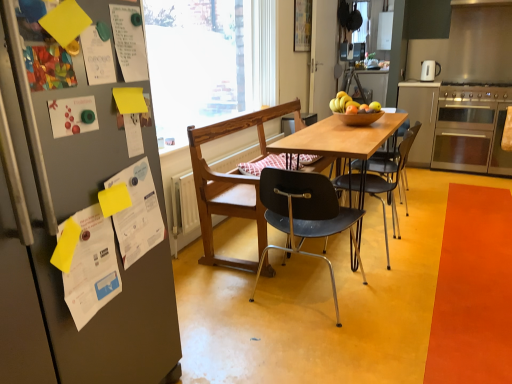
Where is `wooden bowl at center`? Image resolution: width=512 pixels, height=384 pixels. wooden bowl at center is located at coordinates (359, 118).

The width and height of the screenshot is (512, 384). What do you see at coordinates (302, 25) in the screenshot? I see `wooden framed poster at upper center, which is the seventh poster from bottom to top` at bounding box center [302, 25].

This screenshot has width=512, height=384. Describe the element at coordinates (340, 138) in the screenshot. I see `wooden table at center` at that location.

You are a GUI agent. You are given a task and a screenshot of the screen. Output one action in this format:
    pyautogui.click(x=<x>, y=<y>)
    Task: Click on the white glossy electric kettle at upper right
    The image size is (512, 384).
    Given the screenshot: What is the action you would take?
    pyautogui.click(x=429, y=70)

The height and width of the screenshot is (384, 512). I want to click on wooden bowl at center, so tap(359, 118).

Considering the positions of point (449, 353) and point (368, 182), is point (449, 353) closer or farther from the camera than point (368, 182)?

Point (449, 353).

Who is taller, orange matte mat at lower right or black plastic chair at center, positioned as the third chair in front-to-back order?

black plastic chair at center, positioned as the third chair in front-to-back order, is taller.

Looking at this image, considering the sizes of orange matte mat at lower right and black plastic chair at center, positioned as the third chair in front-to-back order, in the image, is orange matte mat at lower right wider or thinner than black plastic chair at center, positioned as the third chair in front-to-back order,?

Clearly, orange matte mat at lower right has more width compared to black plastic chair at center, positioned as the third chair in front-to-back order.

The width and height of the screenshot is (512, 384). Find the location of `mat lying below the black plastic chair at center, which appears as the 1th chair when viewed from the back (from the image's perspective)`. mat lying below the black plastic chair at center, which appears as the 1th chair when viewed from the back (from the image's perspective) is located at coordinates (473, 290).

Does yellow paper at left, which appears as the second poster when viewed from the back, appear on the left side of wooden framed poster at upper center, the first poster from the right?

Correct, you'll find yellow paper at left, which appears as the second poster when viewed from the back, to the left of wooden framed poster at upper center, the first poster from the right.

How many degrees apart are the facing directions of yellow paper at left, the 6th poster from the left, and wooden framed poster at upper center, the seventh poster in the front-to-back sequence?

There is a 3.97-degree angle between the facing directions of yellow paper at left, the 6th poster from the left, and wooden framed poster at upper center, the seventh poster in the front-to-back sequence.

From a real-world perspective, who is located higher, yellow paper at left, the second poster when ordered from bottom to top, or wooden framed poster at upper center, the first poster from the back?

In real-world perspective, wooden framed poster at upper center, the first poster from the back, is above.

In the scene shown: Is yellow paper at left, the second poster when ordered from bottom to top, positioned beyond the bounds of wooden framed poster at upper center, the first poster from the back?

yellow paper at left, the second poster when ordered from bottom to top, lies outside wooden framed poster at upper center, the first poster from the back,'s area.

At what (x,y) coordinates should I click in order to perform the action: click on poster located behind the stainless steel oven at right. Please return your answer as a coordinate pair (x, y). Looking at the image, I should click on (302, 25).

Could you tell me if stainless steel oven at right is turned towards wooden framed poster at upper center, the seventh poster in the front-to-back sequence?

No, stainless steel oven at right is not facing towards wooden framed poster at upper center, the seventh poster in the front-to-back sequence.

Is stainless steel oven at right far from wooden framed poster at upper center, which is the 1th poster from top to bottom?

Yes, stainless steel oven at right and wooden framed poster at upper center, which is the 1th poster from top to bottom, are located far from each other.

Could you tell me if wooden bowl at center is turned towards black plastic chair at center, which appears as the 3th chair when viewed from the back?

No.

Between wooden bowl at center and black plastic chair at center, which appears as the 3th chair when viewed from the back, which one has less height?

wooden bowl at center is shorter.

From the picture: From the image's perspective, is wooden bowl at center positioned above or below black plastic chair at center, the first chair when ordered from front to back?

From the image's perspective, wooden bowl at center appears above black plastic chair at center, the first chair when ordered from front to back.

Who is taller, black plastic chair at center, positioned as the third chair in front-to-back order, or black plastic chair at center, the first chair when ordered from front to back?

black plastic chair at center, positioned as the third chair in front-to-back order, is taller.

How different are the orientations of black plastic chair at center, positioned as the third chair in front-to-back order, and black plastic chair at center, which appears as the 3th chair when viewed from the back, in degrees?

The facing directions of black plastic chair at center, positioned as the third chair in front-to-back order, and black plastic chair at center, which appears as the 3th chair when viewed from the back, are 90 degrees apart.

Considering the relative sizes of black plastic chair at center, which appears as the 1th chair when viewed from the back, and black plastic chair at center, which appears as the 3th chair when viewed from the back, in the image provided, is black plastic chair at center, which appears as the 1th chair when viewed from the back, smaller than black plastic chair at center, which appears as the 3th chair when viewed from the back,?

Indeed, black plastic chair at center, which appears as the 1th chair when viewed from the back, has a smaller size compared to black plastic chair at center, which appears as the 3th chair when viewed from the back.

Is black plastic chair at center, the first chair when ordered from front to back, at the back of black plastic chair at center, positioned as the third chair in front-to-back order?

No, black plastic chair at center, positioned as the third chair in front-to-back order, is not facing the opposite direction of black plastic chair at center, the first chair when ordered from front to back.

From a real-world perspective, is wooden chair at center, placed as the second chair when sorted from back to front, located higher than white paper at upper left, placed as the second poster when sorted from top to bottom?

No, from a real-world perspective, wooden chair at center, placed as the second chair when sorted from back to front, is not on top of white paper at upper left, placed as the second poster when sorted from top to bottom.

From the image's perspective, is wooden chair at center, placed as the second chair when sorted from back to front, positioned above or below white paper at upper left, positioned as the third poster in back-to-front order?

Clearly, from the image's perspective, wooden chair at center, placed as the second chair when sorted from back to front, is below white paper at upper left, positioned as the third poster in back-to-front order.

Is wooden chair at center, placed as the second chair when sorted from back to front, far away from white paper at upper left, acting as the fifth poster starting from the front?

Yes, wooden chair at center, placed as the second chair when sorted from back to front, is far from white paper at upper left, acting as the fifth poster starting from the front.

This screenshot has width=512, height=384. Find the location of `poster that is the 6th object above the wooden chair at center, placed as the second chair when sorted from back to front (from a real-world perspective)`. poster that is the 6th object above the wooden chair at center, placed as the second chair when sorted from back to front (from a real-world perspective) is located at coordinates (129, 42).

Is black plastic chair at center, which appears as the 1th chair when viewed from the back, not close to matte white cabinet at right?

That's right, there is a large distance between black plastic chair at center, which appears as the 1th chair when viewed from the back, and matte white cabinet at right.

Which is in front, black plastic chair at center, positioned as the third chair in front-to-back order, or matte white cabinet at right?

black plastic chair at center, positioned as the third chair in front-to-back order, is in front.

Is matte white cabinet at right at the back of black plastic chair at center, which appears as the 1th chair when viewed from the back?

black plastic chair at center, which appears as the 1th chair when viewed from the back, is not turned away from matte white cabinet at right.

Is point (393, 166) closer or farther from the camera than point (403, 101)?

Point (393, 166).

The image size is (512, 384). What are the coordinates of `mat below the black plastic chair at center, which appears as the 1th chair when viewed from the back (from a real-world perspective)` in the screenshot? It's located at (473, 290).

This screenshot has width=512, height=384. Identify the location of poster located behind the yellow paper at left, the 2th poster from the right. (302, 25).

Considering their positions, is orange matte mat at lower right positioned further to yellow paper at left, the 2th poster from the right, than multicolored paper at left, arranged as the first poster when viewed from the left?

orange matte mat at lower right is further to yellow paper at left, the 2th poster from the right.

Based on their spatial positions, is wooden table at center or wooden bowl at center further from multicolored paper at left, marked as the fourth poster in a bottom-to-top arrangement?

The object further to multicolored paper at left, marked as the fourth poster in a bottom-to-top arrangement, is wooden bowl at center.

Consider the image. From the image, which object appears to be nearer to wooden bowl at center, wooden framed poster at upper center, the first poster from the back, or shiny brown bowl at center?

shiny brown bowl at center lies closer to wooden bowl at center than the other object.

Estimate the real-world distances between objects in this image. Which object is closer to wooden chair at center, placed as the second chair when sorted from back to front, transparent glass window at center or multicolored paper at left, the 4th poster viewed from the top?

Based on the image, transparent glass window at center appears to be nearer to wooden chair at center, placed as the second chair when sorted from back to front.

Considering their positions, is wooden chair at center, the second chair when ordered from front to back, positioned closer to transparent glass window at center than black plastic chair at center, which appears as the 3th chair when viewed from the back?

Among the two, wooden chair at center, the second chair when ordered from front to back, is located nearer to transparent glass window at center.

Which object lies nearer to the anchor point yellow paper at left, placed as the 6th poster when sorted from front to back, wooden bowl at center or orange matte mat at lower right?

orange matte mat at lower right is closer to yellow paper at left, placed as the 6th poster when sorted from front to back.

Based on the photo, looking at the image, which one is located further to matte paper poster at left, which is the sixth poster in back-to-front order, transparent glass window at center or white paper with printed text at left, the first poster positioned from the bottom?

transparent glass window at center is positioned further to the anchor matte paper poster at left, which is the sixth poster in back-to-front order.

Estimate the real-world distances between objects in this image. Which object is further from matte paper poster at left, positioned as the sixth poster in right-to-left order, black plastic chair at center, positioned as the third chair in front-to-back order, or matte white cabinet at right?

Based on the image, matte white cabinet at right appears to be further to matte paper poster at left, positioned as the sixth poster in right-to-left order.

Where is `table between yellow paper at left, which appears as the second poster when viewed from the back, and orange matte mat at lower right from left to right`? table between yellow paper at left, which appears as the second poster when viewed from the back, and orange matte mat at lower right from left to right is located at coordinates (340, 138).

Locate an element on the screen. The height and width of the screenshot is (384, 512). table between white paper at upper left, acting as the fifth poster starting from the front, and wooden chair at center, the second chair when ordered from front to back, in the front-back direction is located at coordinates (340, 138).

This screenshot has width=512, height=384. Identify the location of bowl between matte paper poster at left, which is the 2th poster in front-to-back order, and shiny brown bowl at center in the front-back direction. (359, 118).

Find the location of a particular element. This screenshot has height=384, width=512. fruit positioned between wooden chair at center, the second chair when ordered from front to back, and matte white cabinet at right from near to far is located at coordinates (352, 105).